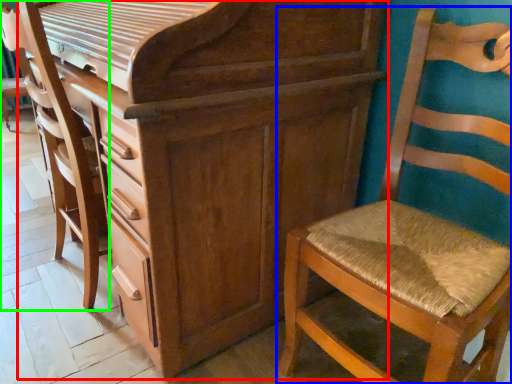
Question: Which is farther away from chest of drawers (highlighted by a red box)? chair (highlighted by a blue box) or swivel chair (highlighted by a green box)?

Choices:
 (A) chair
 (B) swivel chair

Answer: (B)